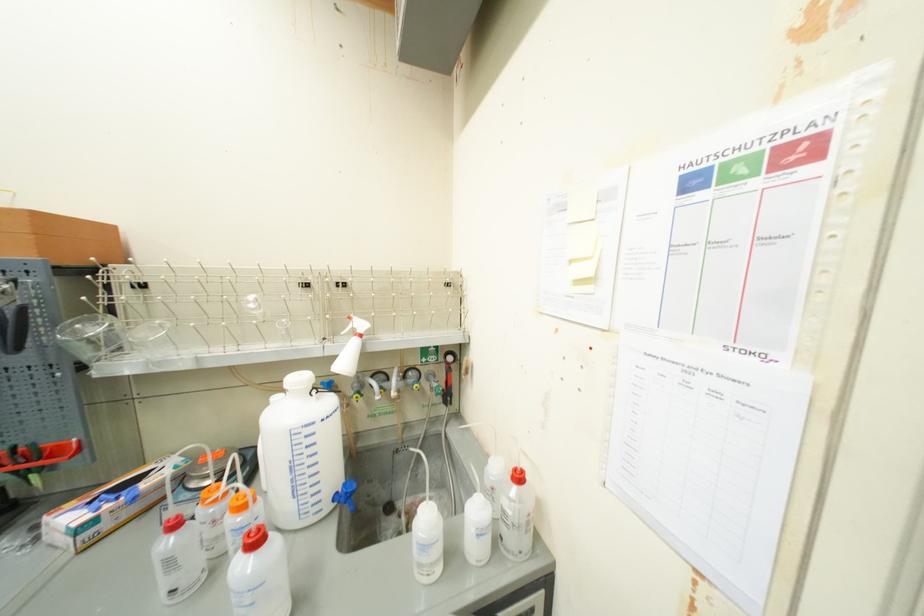
Describe the element at coordinates (410, 389) in the screenshot. I see `the green valve knob` at that location.